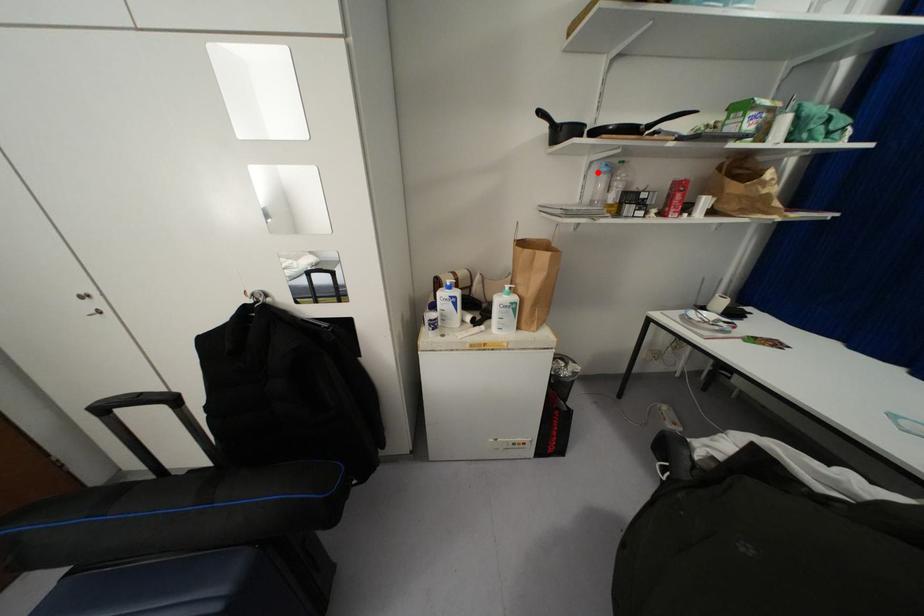
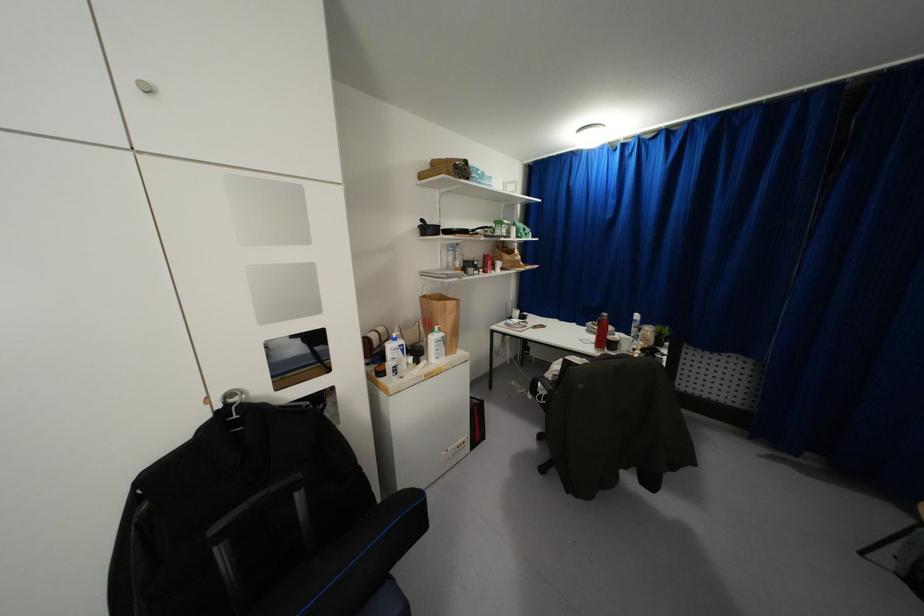
Locate, in the second image, the point that corresponds to the highlighted location in the first image.

(446, 249)